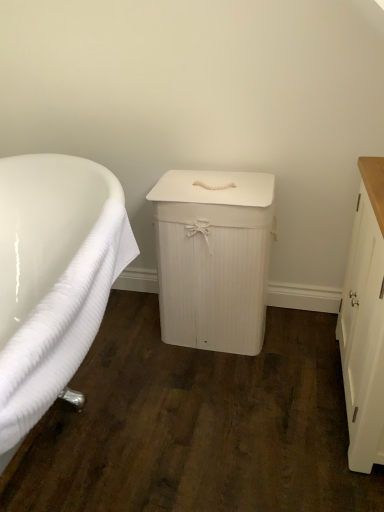
This screenshot has width=384, height=512. In order to click on free location in front of white wood laundry bin at center, which ranks as the 1th cabinetry in left-to-right order in this screenshot , I will do `click(217, 400)`.